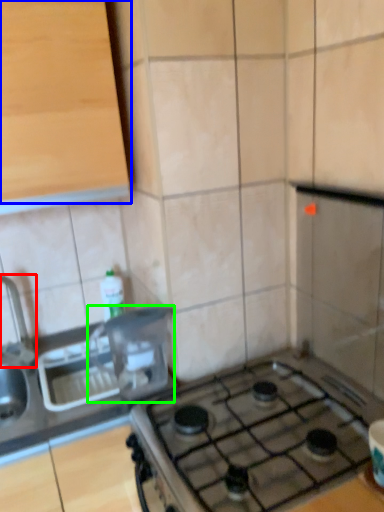
Question: Considering the real-world distances, which object is closest to faucet (highlighted by a red box)? cabinetry (highlighted by a blue box) or appliance (highlighted by a green box).

Choices:
 (A) cabinetry
 (B) appliance

Answer: (B)